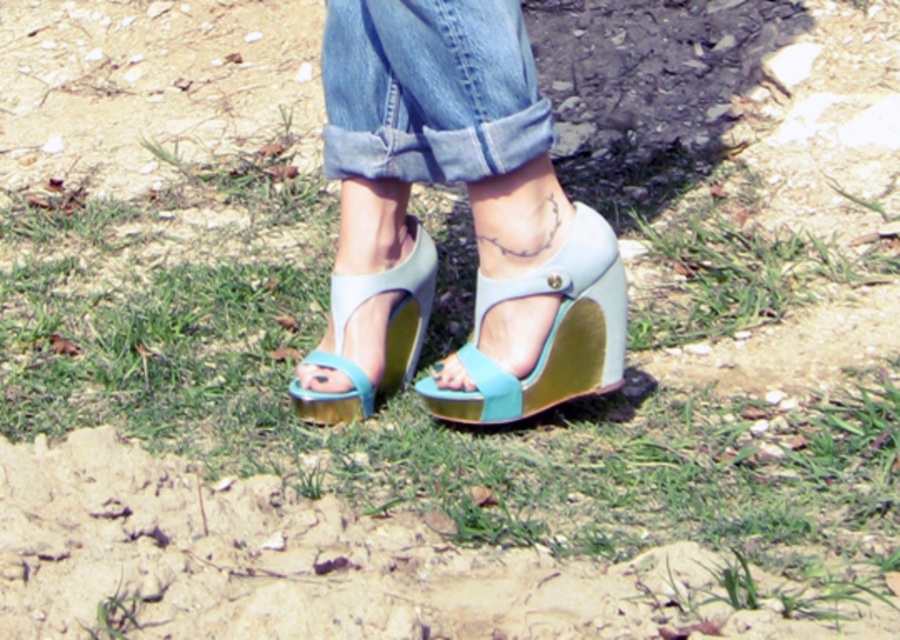
Is denim at center below light blue suede wedge at center?

Incorrect, denim at center is not positioned below light blue suede wedge at center.

Which is above, denim at center or light blue suede wedge at center?

denim at center is higher up.

Who is more forward, (x=513, y=168) or (x=547, y=342)?

Point (x=513, y=168)

What are the coordinates of `denim at center` in the screenshot? It's located at (429, 90).

Who is more distant from viewer, (595, 298) or (402, 368)?

Positioned behind is point (402, 368).

Is light blue suede wedge at center to the right of light blue leather sandal at center from the viewer's perspective?

Yes, light blue suede wedge at center is to the right of light blue leather sandal at center.

The width and height of the screenshot is (900, 640). In order to click on light blue suede wedge at center in this screenshot , I will do `click(547, 333)`.

In order to click on light blue suede wedge at center in this screenshot , I will do `click(547, 333)`.

How far apart are denim at center and light blue leather sandal at center?

denim at center and light blue leather sandal at center are 11.25 inches apart.

Which is more to the left, denim at center or light blue leather sandal at center?

Positioned to the left is light blue leather sandal at center.

This screenshot has width=900, height=640. What do you see at coordinates (429, 90) in the screenshot? I see `denim at center` at bounding box center [429, 90].

Identify the location of denim at center. Image resolution: width=900 pixels, height=640 pixels. (429, 90).